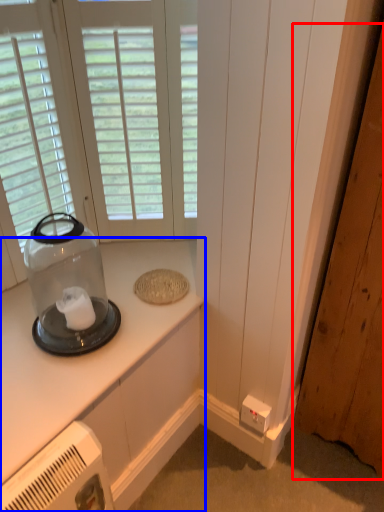
Question: Which object is further to the camera taking this photo, door (highlighted by a red box) or countertop (highlighted by a blue box)?

Choices:
 (A) door
 (B) countertop

Answer: (B)